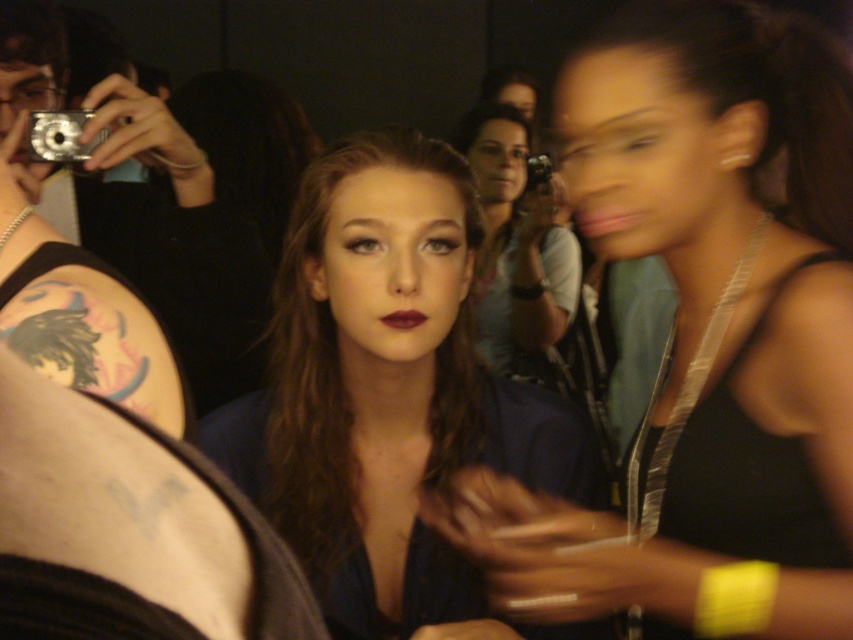
Who is positioned more to the left, matte blue dress at center or matte black camera at center?

matte blue dress at center is more to the left.

Is point (566, 460) farther from viewer compared to point (491, 237)?

No, (566, 460) is closer to viewer.

Where is `matte blue dress at center`? matte blue dress at center is located at coordinates (386, 390).

This screenshot has height=640, width=853. What are the coordinates of `matte blue dress at center` in the screenshot? It's located at coord(386,390).

Can you confirm if matte blue dress at center is smaller than silver metallic camera at center?

No, matte blue dress at center is not smaller than silver metallic camera at center.

Measure the distance between point (265, 481) and camera.

3.28 feet

I want to click on matte blue dress at center, so click(x=386, y=390).

Is point (746, 163) closer to camera compared to point (505, 273)?

Yes, point (746, 163) is in front of point (505, 273).

Does black satin dress at right have a greater width compared to matte black camera at center?

Yes.

Which is behind, point (831, 333) or point (474, 301)?

Positioned behind is point (474, 301).

Where is `black satin dress at right`? The width and height of the screenshot is (853, 640). black satin dress at right is located at coordinates (704, 336).